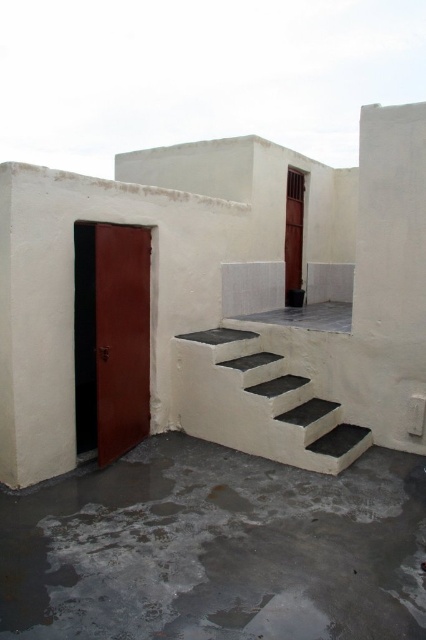
Between gray concrete at center and satin wood door at center, which one is positioned higher?

satin wood door at center

The image size is (426, 640). Describe the element at coordinates (216, 548) in the screenshot. I see `gray concrete at center` at that location.

Describe the element at coordinates (216, 548) in the screenshot. This screenshot has width=426, height=640. I see `gray concrete at center` at that location.

Locate an element on the screen. The width and height of the screenshot is (426, 640). gray concrete at center is located at coordinates (216, 548).

Who is lower down, white concrete stairs at center or satin wood door at center?

Positioned lower is white concrete stairs at center.

Does point (307, 403) come in front of point (106, 260)?

No, it is not.

Identify the location of white concrete stairs at center. (258, 403).

Identify the location of white concrete stairs at center. The height and width of the screenshot is (640, 426). (258, 403).

Between point (199, 442) and point (362, 440), which one is positioned in front?

Point (362, 440) is more forward.

Can you confirm if gray concrete at center is smaller than white concrete stairs at center?

Yes, gray concrete at center is smaller than white concrete stairs at center.

At what (x,y) coordinates should I click in order to perform the action: click on gray concrete at center. Please return your answer as a coordinate pair (x, y). The height and width of the screenshot is (640, 426). Looking at the image, I should click on (216, 548).